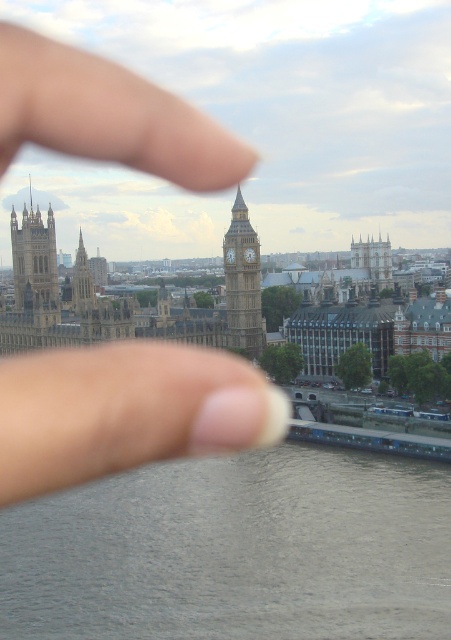
Question: Which point is closer to the camera?

Choices:
 (A) (123, 102)
 (B) (234, 356)

Answer: (A)

Question: Which object appears farthest from the camera in this image?

Choices:
 (A) green stone tower at center
 (B) gray smooth water at lower center
 (C) white matte finger at center

Answer: (A)

Question: Estimate the real-world distances between objects in this image. Which object is farther from the white matte finger at center?

Choices:
 (A) golden stone tower at upper left
 (B) gray smooth water at lower center

Answer: (A)

Question: Is gray smooth water at lower center to the right of green stone tower at center from the viewer's perspective?

Choices:
 (A) yes
 (B) no

Answer: (A)

Question: Is golden stone clock tower at center thinner than green stone tower at center?

Choices:
 (A) yes
 (B) no

Answer: (A)

Question: Is golden stone tower at upper left to the right of green stone tower at center from the viewer's perspective?

Choices:
 (A) no
 (B) yes

Answer: (A)